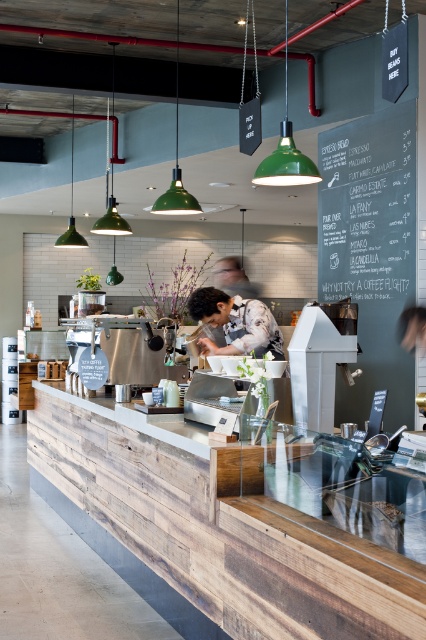
Is wooden counter at center thinner than matte black shirt at center?

No.

Which is behind, point (334, 540) or point (279, 337)?

The point (279, 337) is behind.

Who is more forward, (382, 577) or (282, 348)?

Point (382, 577) is in front.

I want to click on wooden counter at center, so click(218, 525).

Between wooden counter at center and black chalkboard menu at upper right, which one appears on the right side from the viewer's perspective?

Positioned to the right is black chalkboard menu at upper right.

Is wooden counter at center behind black chalkboard menu at upper right?

No, it is not.

This screenshot has height=640, width=426. In order to click on wooden counter at center in this screenshot , I will do `click(218, 525)`.

The image size is (426, 640). What do you see at coordinates (371, 250) in the screenshot?
I see `black chalkboard menu at upper right` at bounding box center [371, 250].

Locate an element on the screen. Image resolution: width=426 pixels, height=640 pixels. black chalkboard menu at upper right is located at coordinates [371, 250].